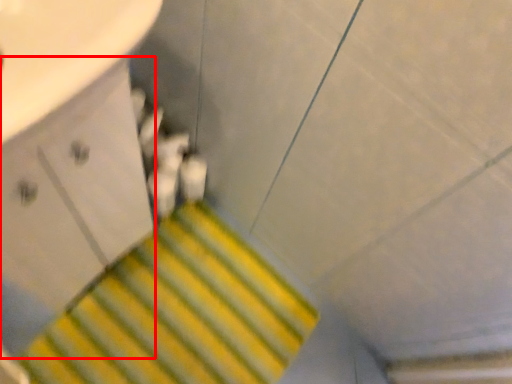
Question: From the image's perspective, considering the relative positions of drawer (annotated by the red box) and stairs in the image provided, where is drawer (annotated by the red box) located with respect to the staircase?

Choices:
 (A) below
 (B) above

Answer: (B)